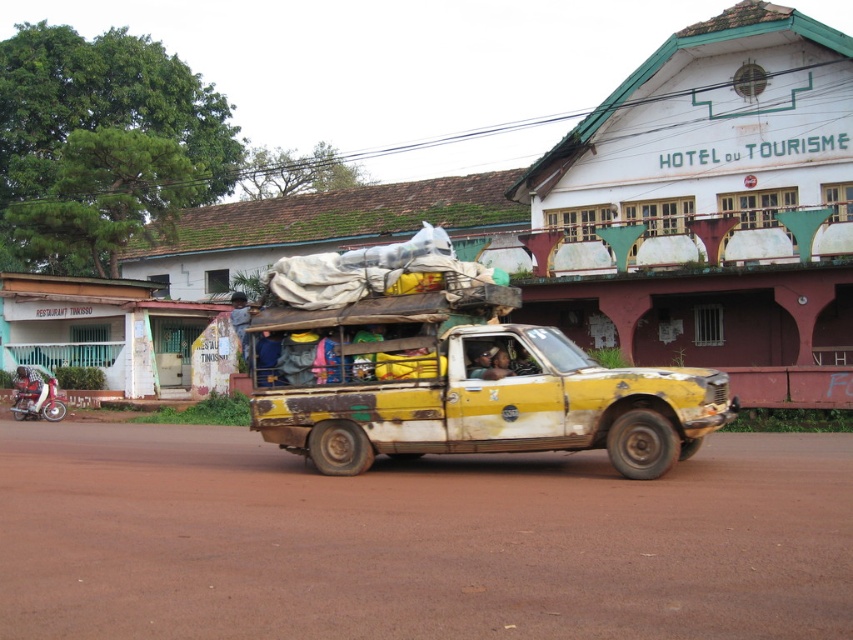
Question: Is rusty yellow pickup truck at center wider than brushed metal motorcycle at lower left?

Choices:
 (A) no
 (B) yes

Answer: (B)

Question: Which object is closer to the camera taking this photo?

Choices:
 (A) rusty yellow pickup truck at center
 (B) brushed metal motorcycle at lower left
 (C) brown dirt track at center

Answer: (C)

Question: Which of these objects is positioned farthest from the rusty yellow pickup truck at center?

Choices:
 (A) brown dirt track at center
 (B) brushed metal motorcycle at lower left

Answer: (B)

Question: Which object is positioned farthest from the brown dirt track at center?

Choices:
 (A) brushed metal motorcycle at lower left
 (B) rusty yellow pickup truck at center

Answer: (A)

Question: Does brown dirt track at center have a greater width compared to brushed metal motorcycle at lower left?

Choices:
 (A) no
 (B) yes

Answer: (B)

Question: Observing the image, what is the correct spatial positioning of rusty yellow pickup truck at center in reference to brushed metal motorcycle at lower left?

Choices:
 (A) below
 (B) above

Answer: (B)